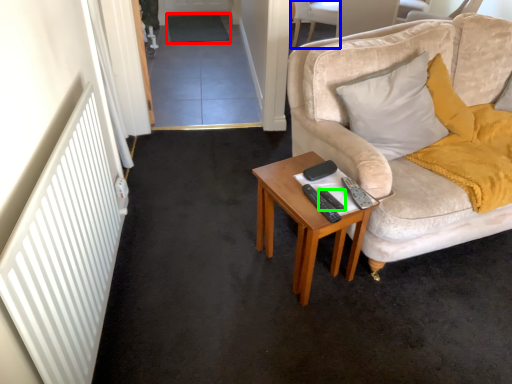
Question: Which object is positioned farthest from plain (highlighted by a red box)? Select from chair (highlighted by a blue box) and remote control (highlighted by a green box).

Choices:
 (A) chair
 (B) remote control

Answer: (B)